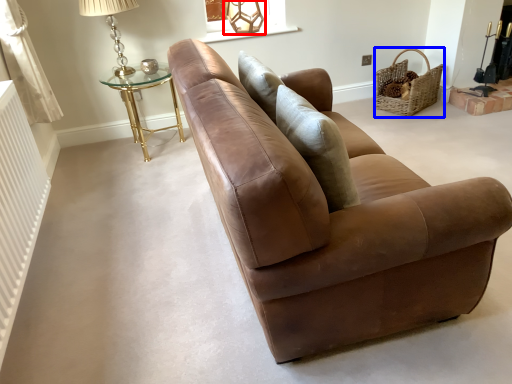
Question: Which object is further to the camera taking this photo, table lamp (highlighted by a red box) or basket (highlighted by a blue box)?

Choices:
 (A) table lamp
 (B) basket

Answer: (A)